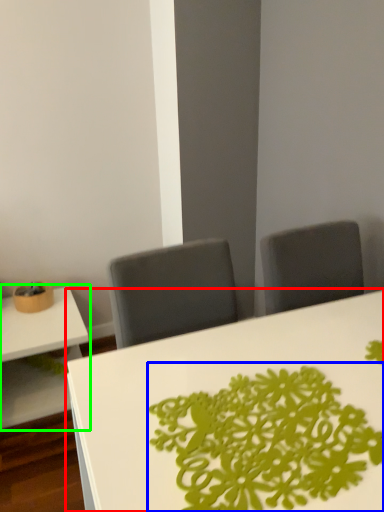
Question: Considering the real-world distances, which object is closest to table (highlighted by a red box)? floral arrangement (highlighted by a blue box) or table (highlighted by a green box).

Choices:
 (A) floral arrangement
 (B) table

Answer: (A)